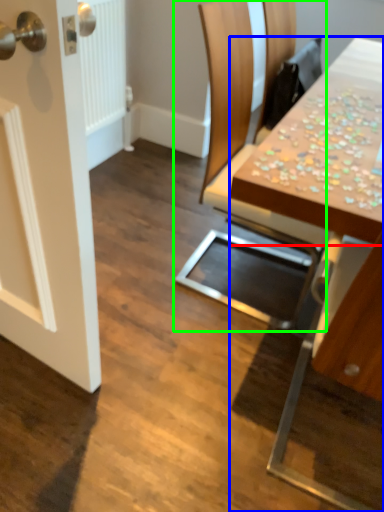
Question: Based on their relative distances, which object is farther from counter top (highlighted by a red box)? Choose from table (highlighted by a blue box) and chair (highlighted by a green box).

Choices:
 (A) table
 (B) chair

Answer: (B)